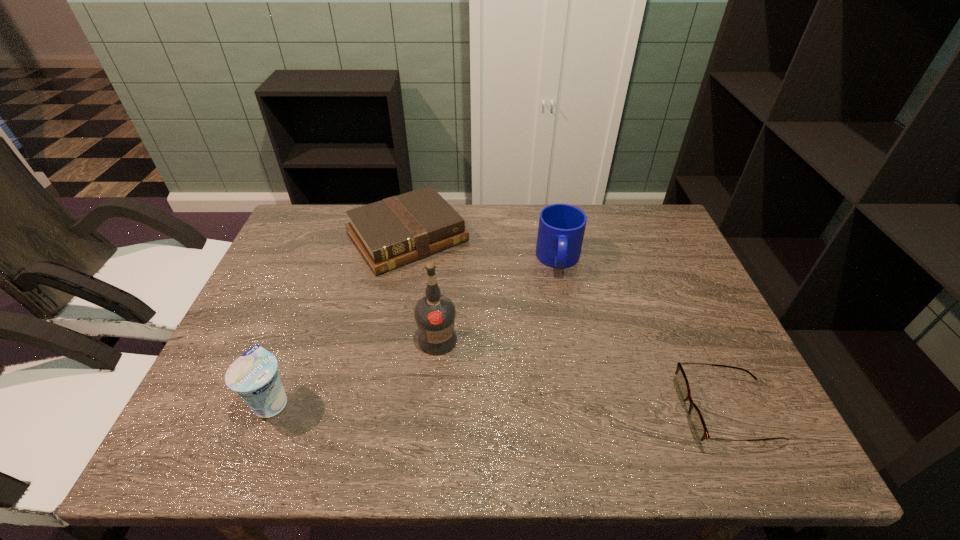
Locate an element on the screen. The height and width of the screenshot is (540, 960). Bible at the far edge is located at coordinates (389, 233).

Locate an element on the screen. This screenshot has width=960, height=540. mug situated at the far edge is located at coordinates (561, 229).

I want to click on yogurt located in the near edge section of the desktop, so click(x=254, y=376).

Identify the location of spectacles present at the near edge. (697, 425).

The image size is (960, 540). What are the coordinates of `object located at the left edge` in the screenshot? It's located at (254, 376).

Identify the location of object that is at the right edge. (697, 425).

Where is `object that is at the near left corner`? object that is at the near left corner is located at coordinates (254, 376).

Identify the location of object positioned at the near right corner. (697, 425).

In the image, there is a desktop. Where is `vacant space at the far edge`? This screenshot has height=540, width=960. vacant space at the far edge is located at coordinates (573, 204).

What are the coordinates of `vacant area at the near edge of the desktop` in the screenshot? It's located at (354, 391).